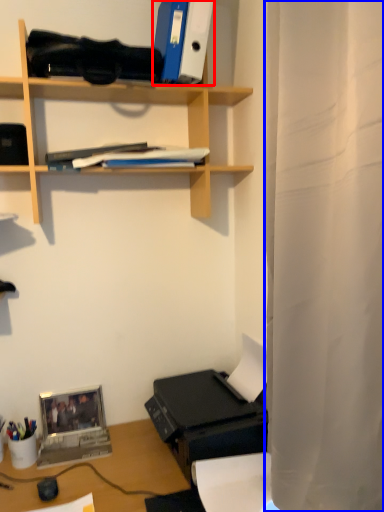
Question: Which point is further to the camera, paperback book (highlighted by a red box) or shower curtain (highlighted by a blue box)?

Choices:
 (A) paperback book
 (B) shower curtain

Answer: (A)